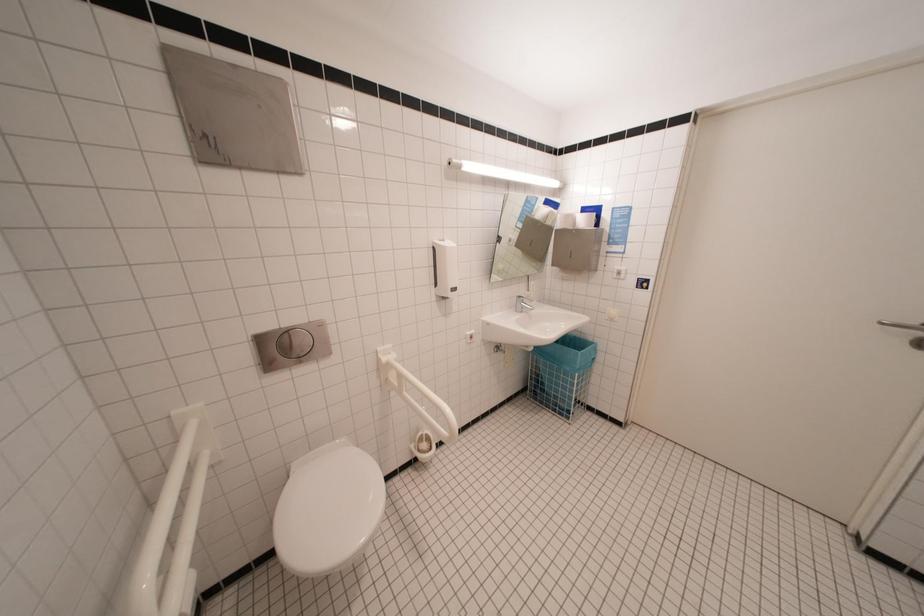
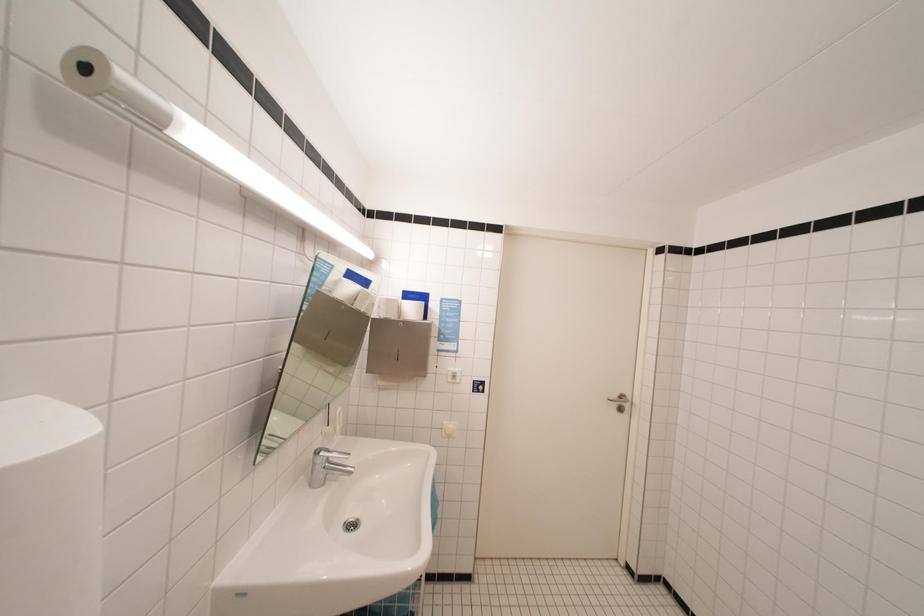
Question: The camera is either moving clockwise (left) or counter-clockwise (right) around the object. The first image is from the beginning of the video and the second image is from the end. Is the camera moving left or right when shooting the video?

Choices:
 (A) Left
 (B) Right

Answer: (A)